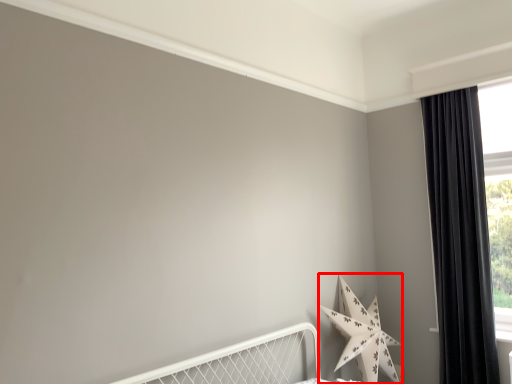
Question: Observing the image, what is the correct spatial positioning of star (annotated by the red box) in reference to curtain?

Choices:
 (A) right
 (B) left

Answer: (B)